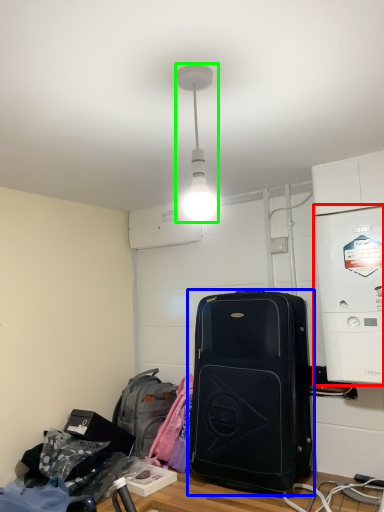
Question: Considering the real-world distances, which object is farthest from appliance (highlighted by a red box)? luggage and bags (highlighted by a blue box) or lamp (highlighted by a green box)?

Choices:
 (A) luggage and bags
 (B) lamp

Answer: (B)